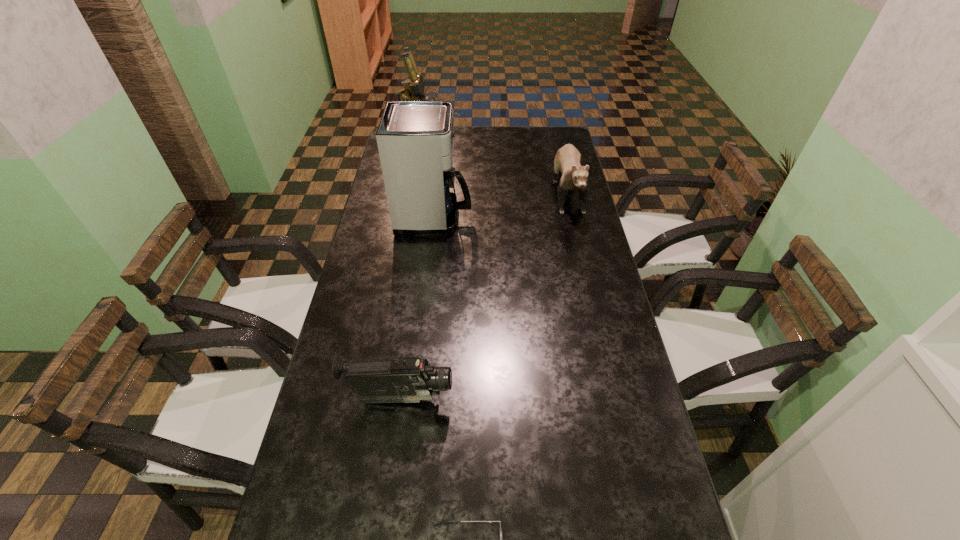
Image resolution: width=960 pixels, height=540 pixels. What are the coordinates of `microscope` in the screenshot? It's located at (537, 256).

Locate an element on the screen. coffee maker is located at coordinates (379, 268).

Where is `ferret`? Image resolution: width=960 pixels, height=540 pixels. ferret is located at coordinates (416, 205).

Image resolution: width=960 pixels, height=540 pixels. In order to click on the rightmost object in this screenshot , I will do `click(416, 205)`.

You are a GUI agent. You are given a task and a screenshot of the screen. Output one action in this format:
    pyautogui.click(x=<x>, y=<y>)
    Task: Click on the free spot located at the eyepieces of the microscope
    
    Given the screenshot: What is the action you would take?
    pyautogui.click(x=470, y=151)

You are a GUI agent. You are given a task and a screenshot of the screen. Output one action in this format:
    pyautogui.click(x=<x>, y=<y>)
    Task: Click on the vacant position located on the front panel of the coffee maker
    This screenshot has height=540, width=960.
    Given the screenshot: What is the action you would take?
    pyautogui.click(x=489, y=217)

Find the location of `free space located on the face of the ferret`. free space located on the face of the ferret is located at coordinates (579, 240).

Identify the location of object at the far edge. This screenshot has width=960, height=540. (537, 256).

At what (x,y) coordinates should I click in order to perform the action: click on microscope positioned at the left edge. Please return your answer as a coordinate pair (x, y). This screenshot has width=960, height=540. Looking at the image, I should click on (537, 256).

You are a GUI agent. You are given a task and a screenshot of the screen. Output one action in this format:
    pyautogui.click(x=<x>, y=<y>)
    Task: Click on the coffee maker that is positioned at the left edge
    This screenshot has width=960, height=540.
    Given the screenshot: What is the action you would take?
    pyautogui.click(x=379, y=268)